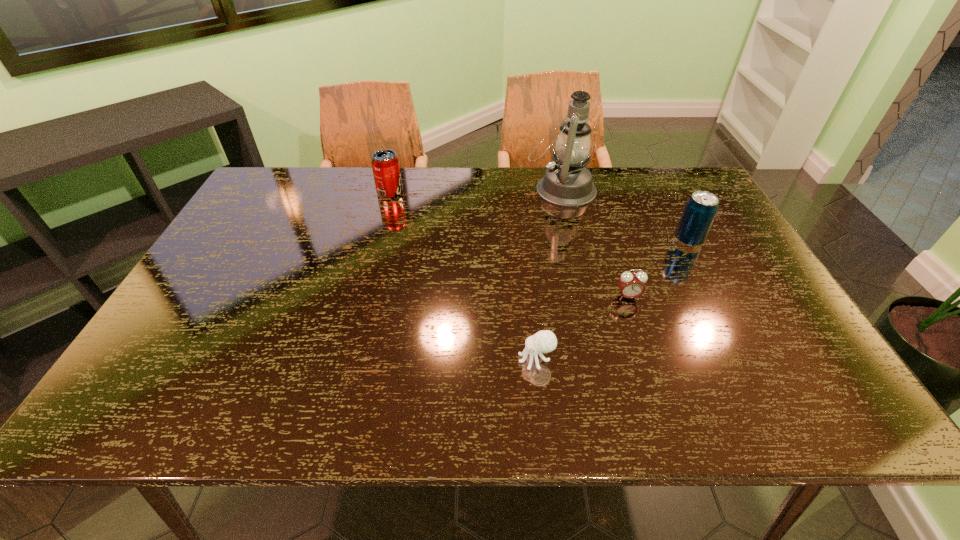
The height and width of the screenshot is (540, 960). What are the coordinates of `vacant area located on the clock face of the alarm clock` in the screenshot? It's located at [x=662, y=400].

You are a GUI agent. You are given a task and a screenshot of the screen. Output one action in this format:
    pyautogui.click(x=<x>, y=<y>)
    Task: Click on the vacant space located 0.250m on the front-facing side of the nearest object
    Image resolution: width=960 pixels, height=540 pixels.
    Given the screenshot: What is the action you would take?
    pyautogui.click(x=403, y=359)

The height and width of the screenshot is (540, 960). Identify the location of vacant space located on the front-facing side of the nearest object. (495, 359).

At what (x,y) coordinates should I click in order to perform the action: click on free location located on the front-facing side of the nearest object. Please return your answer as a coordinate pair (x, y). Looking at the image, I should click on (339, 359).

Locate an element on the screen. The width and height of the screenshot is (960, 540). oil lamp located in the far edge section of the desktop is located at coordinates (567, 183).

I want to click on soda can that is at the far edge, so click(385, 164).

This screenshot has width=960, height=540. I want to click on object that is at the right edge, so click(701, 208).

Where is `vacant region at the far edge`? vacant region at the far edge is located at coordinates (614, 176).

Locate an element on the screen. The image size is (960, 540). vacant space at the left edge of the desktop is located at coordinates (186, 372).

In the image, there is a desktop. In order to click on free region at the right edge in this screenshot , I will do `click(679, 219)`.